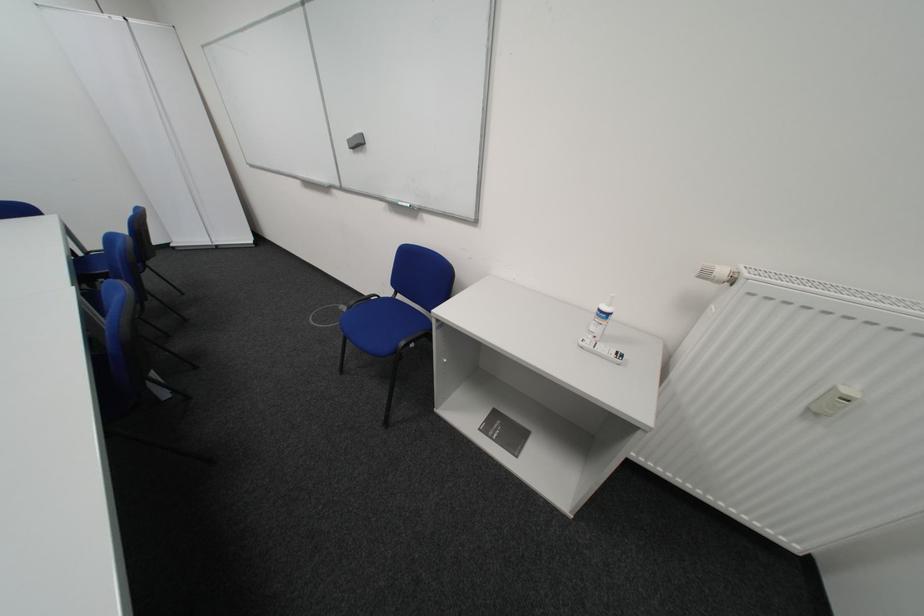
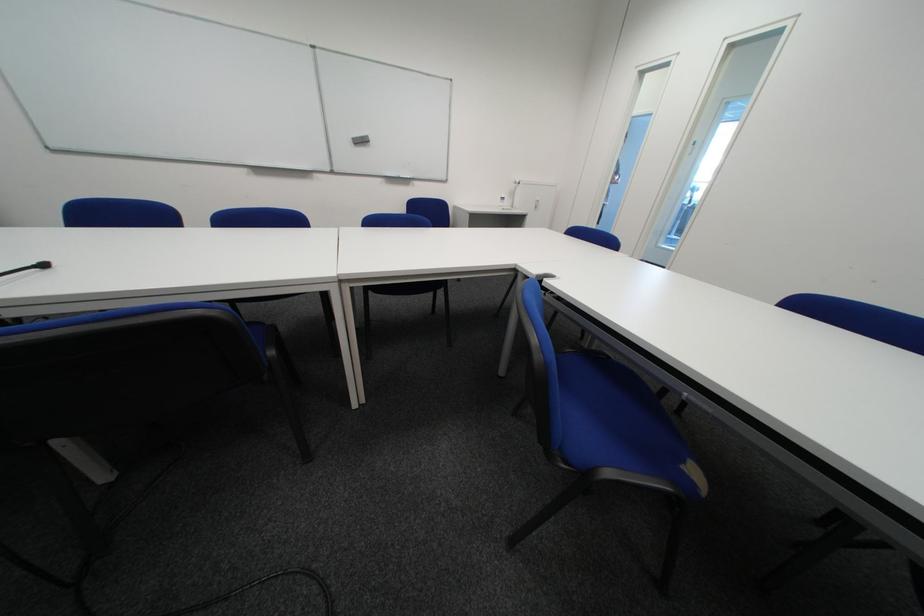
Locate, in the second image, the point that corresponds to (x=361, y=143) in the first image.

(365, 140)